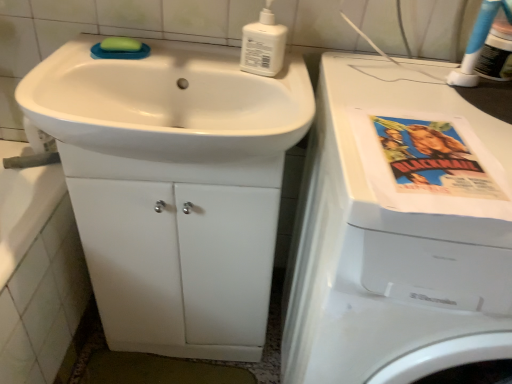
Image resolution: width=512 pixels, height=384 pixels. Find the location of `vacant area that lies between green matte soap at upper left and white plastic bottle at upper center`. vacant area that lies between green matte soap at upper left and white plastic bottle at upper center is located at coordinates (187, 64).